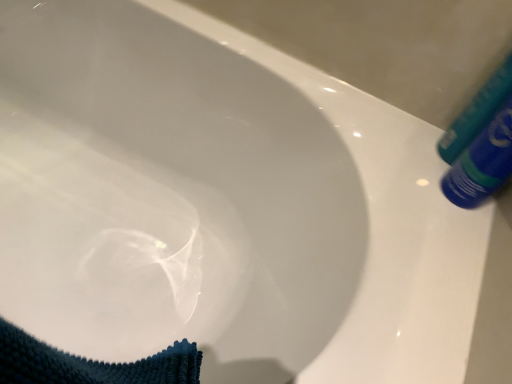
Identify the location of vacant space in front of blue glossy tube at upper right, which appears as the first tube when ordered from the bottom. The height and width of the screenshot is (384, 512). (441, 258).